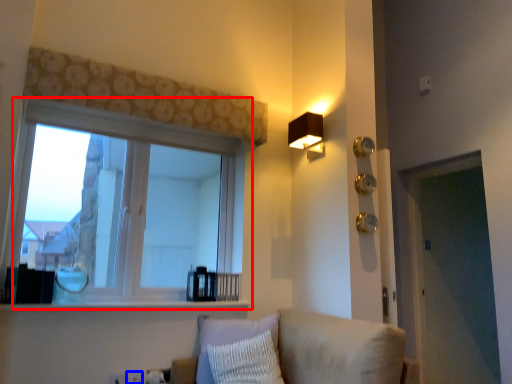
Question: Which object appears farthest to the camera in this image, window (highlighted by a red box) or electric outlet (highlighted by a blue box)?

Choices:
 (A) window
 (B) electric outlet

Answer: (B)